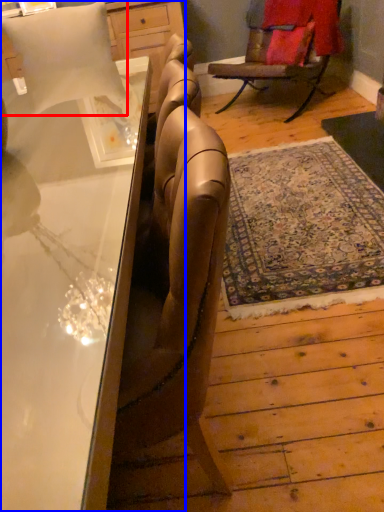
Question: Which point is closer to the camera, pillow (highlighted by a red box) or desk (highlighted by a blue box)?

Choices:
 (A) pillow
 (B) desk

Answer: (B)